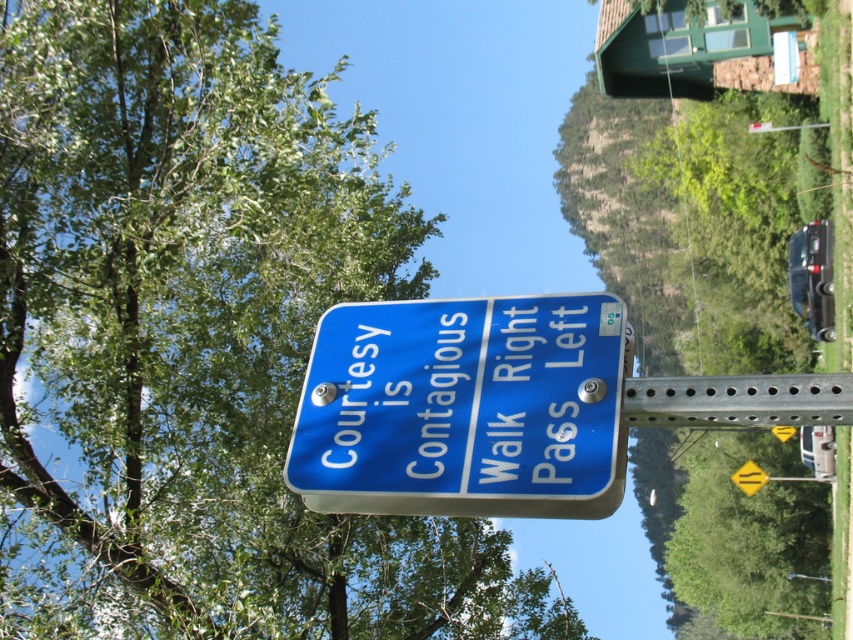
Question: Which of the following is the farthest from the observer?

Choices:
 (A) blue metallic sign at center
 (B) yellow reflective diamond at center

Answer: (B)

Question: Which object appears farthest from the camera in this image?

Choices:
 (A) blue metallic sign at center
 (B) yellow reflective diamond at center
 (C) green leafy tree at upper left

Answer: (B)

Question: Considering the relative positions of blue metallic sign at center and yellow reflective diamond at center in the image provided, where is blue metallic sign at center located with respect to yellow reflective diamond at center?

Choices:
 (A) right
 (B) left

Answer: (B)

Question: Which of the following is the closest to the observer?

Choices:
 (A) (735, 483)
 (B) (614, 392)
 (C) (189, 438)

Answer: (B)

Question: Can you confirm if green leafy tree at upper left is wider than yellow reflective diamond at center?

Choices:
 (A) no
 (B) yes

Answer: (B)

Question: Is green leafy tree at upper left smaller than blue metallic sign at center?

Choices:
 (A) no
 (B) yes

Answer: (A)